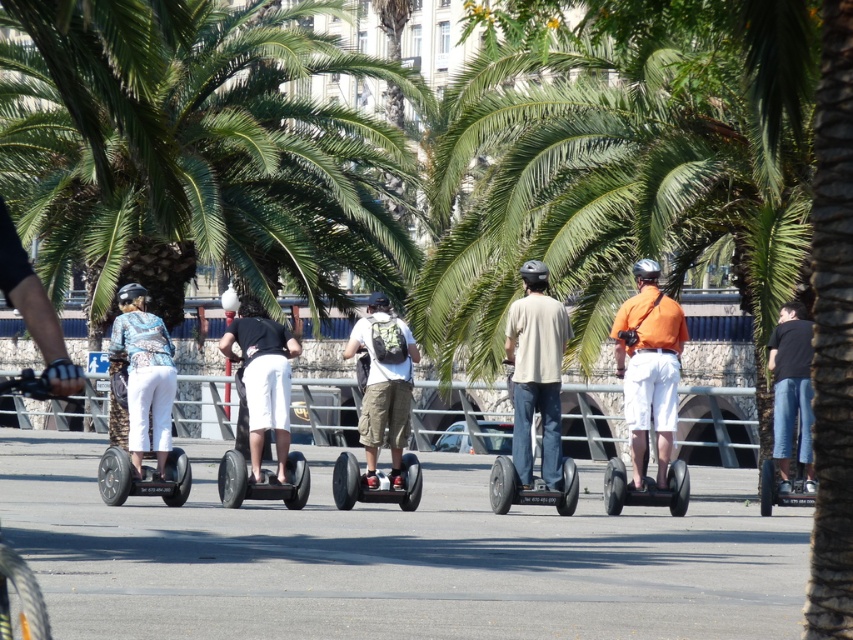
Question: Among these objects, which one is farthest from the camera?

Choices:
 (A) matte black scooter at center
 (B) matte black backpack at center
 (C) beige cotton shirt at center
 (D) patterned fabric pants at center

Answer: (A)

Question: Does white matte shorts at center appear over camouflage-patterned scooter at center-left?

Choices:
 (A) yes
 (B) no

Answer: (A)

Question: Which object is positioned closest to the beige cotton shirt at center?

Choices:
 (A) matte black backpack at center
 (B) matte black glove at left
 (C) white matte shorts at center

Answer: (A)

Question: Among these objects, which one is farthest from the camera?

Choices:
 (A) black rubber scooter at lower left
 (B) matte black scooter at center

Answer: (B)

Question: Is orange matte shirt at center below white matte shorts at center?

Choices:
 (A) yes
 (B) no

Answer: (B)

Question: Is matte black backpack at center above white matte shorts at center?

Choices:
 (A) yes
 (B) no

Answer: (A)